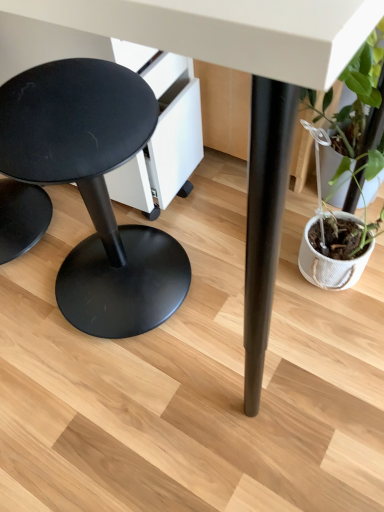
Question: Considering the relative positions of green leafy plant in woven pot at right and matte black stool at left in the image provided, is green leafy plant in woven pot at right to the right of matte black stool at left from the viewer's perspective?

Choices:
 (A) yes
 (B) no

Answer: (A)

Question: Considering the relative positions of green leafy plant in woven pot at right and matte black stool at left in the image provided, is green leafy plant in woven pot at right to the left of matte black stool at left from the viewer's perspective?

Choices:
 (A) yes
 (B) no

Answer: (B)

Question: Is green leafy plant in woven pot at right far from matte black stool at left?

Choices:
 (A) yes
 (B) no

Answer: (B)

Question: From a real-world perspective, is green leafy plant in woven pot at right positioned under matte black stool at left based on gravity?

Choices:
 (A) no
 (B) yes

Answer: (B)

Question: From the image's perspective, is green leafy plant in woven pot at right located above matte black stool at left?

Choices:
 (A) yes
 (B) no

Answer: (A)

Question: Is green leafy plant in woven pot at right positioned with its back to matte black stool at left?

Choices:
 (A) no
 (B) yes

Answer: (A)

Question: From the image's perspective, is matte black stool at left under green leafy plant in woven pot at right?

Choices:
 (A) yes
 (B) no

Answer: (A)

Question: Is matte black stool at left turned away from green leafy plant in woven pot at right?

Choices:
 (A) no
 (B) yes

Answer: (A)

Question: Considering the relative sizes of matte black stool at left and green leafy plant in woven pot at right in the image provided, is matte black stool at left bigger than green leafy plant in woven pot at right?

Choices:
 (A) no
 (B) yes

Answer: (B)

Question: From a real-world perspective, is matte black stool at left under green leafy plant in woven pot at right?

Choices:
 (A) no
 (B) yes

Answer: (A)

Question: Is matte black stool at left closer to the viewer compared to green leafy plant in woven pot at right?

Choices:
 (A) no
 (B) yes

Answer: (B)

Question: Is matte black stool at left completely or partially outside of green leafy plant in woven pot at right?

Choices:
 (A) no
 (B) yes

Answer: (B)

Question: In the image, is green leafy plant in woven pot at right positioned in front of or behind matte black stool at left?

Choices:
 (A) front
 (B) behind

Answer: (B)